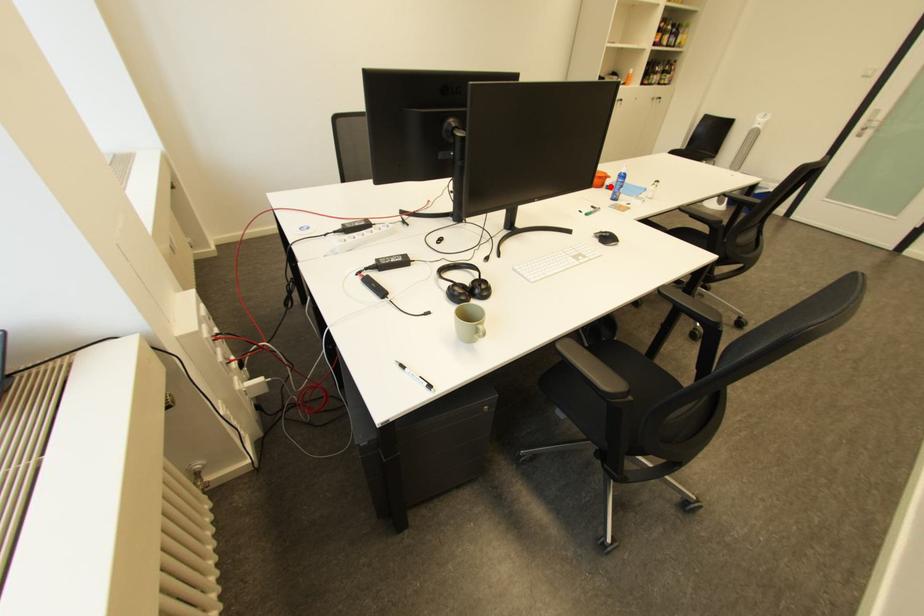
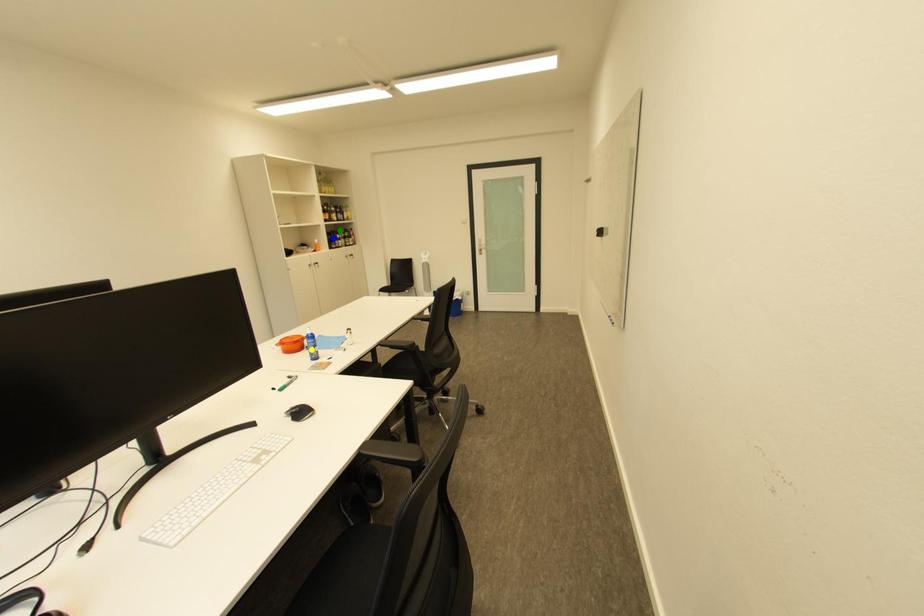
Question: I am providing you with two images of the same scene from different viewpoints. A red point is marked on the first image. You are given multiple points on the second image. Which point in image 2 represents the same 3d spot as the red point in image 1?

Choices:
 (A) green point
 (B) yellow point
 (C) blue point

Answer: (B)